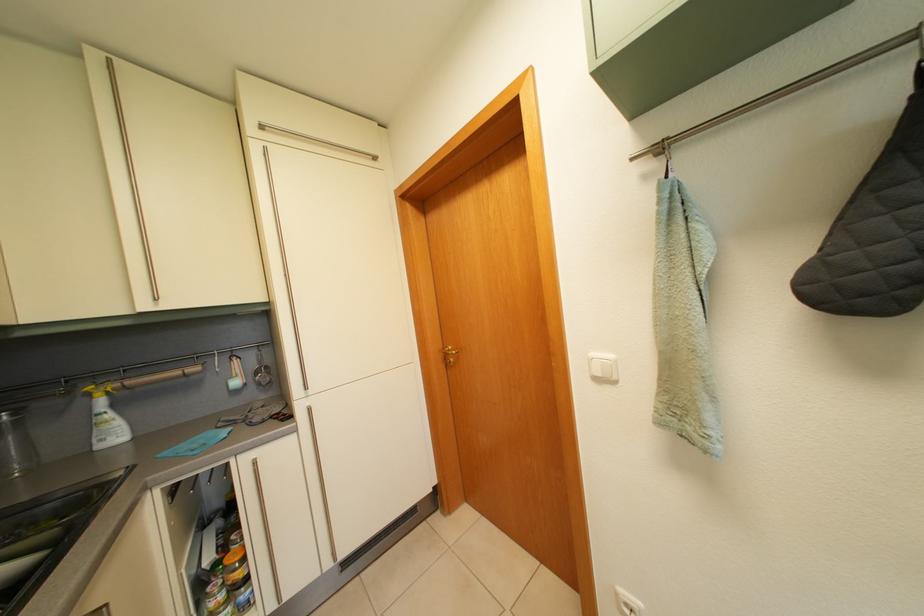
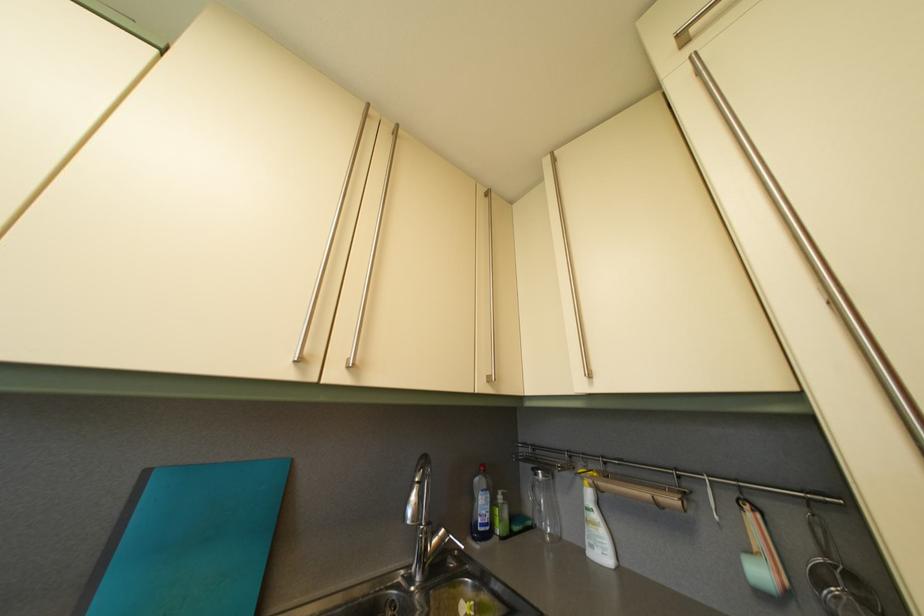
In the second image, find the point that corresponds to point 101,62 in the first image.

(554, 169)